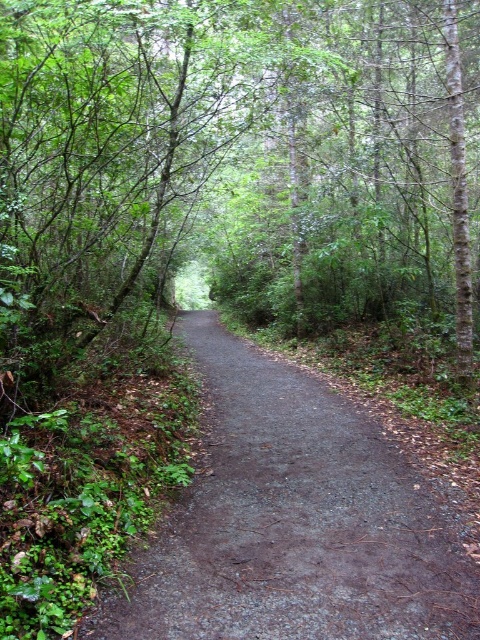
Who is positioned more to the right, green leafy tree at center or dirt/gravel path at center?

dirt/gravel path at center is more to the right.

Is green leafy tree at center behind dirt/gravel path at center?

That is True.

Is point (429, 141) positioned before point (348, 456)?

No, it is not.

Locate an element on the screen. This screenshot has width=480, height=640. green leafy tree at center is located at coordinates (245, 145).